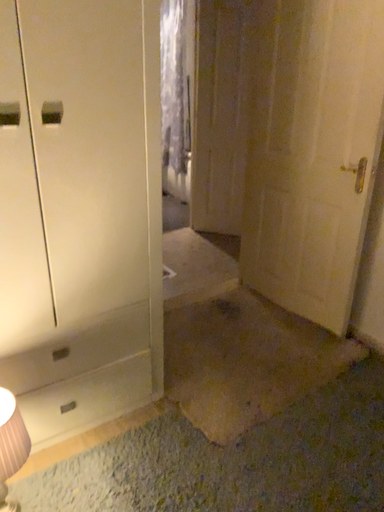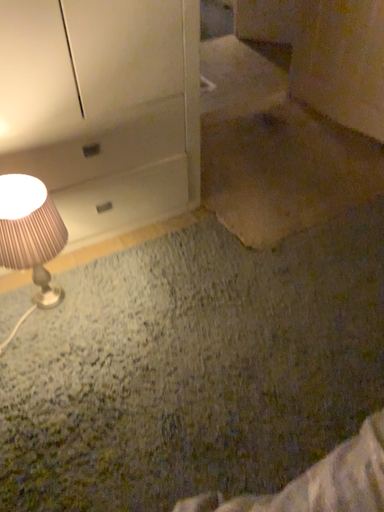
Question: How did the camera likely rotate when shooting the video?

Choices:
 (A) rotated downward
 (B) rotated upward

Answer: (A)